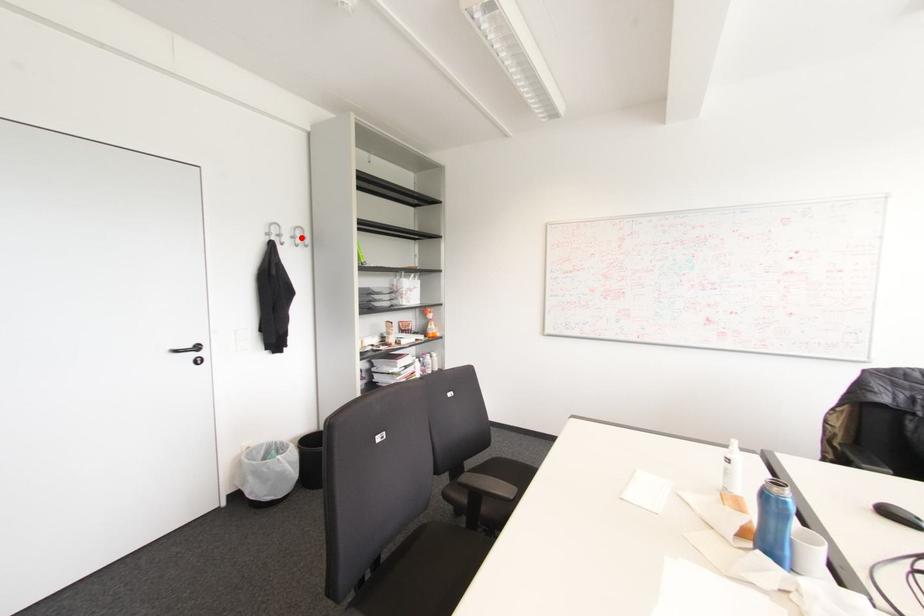
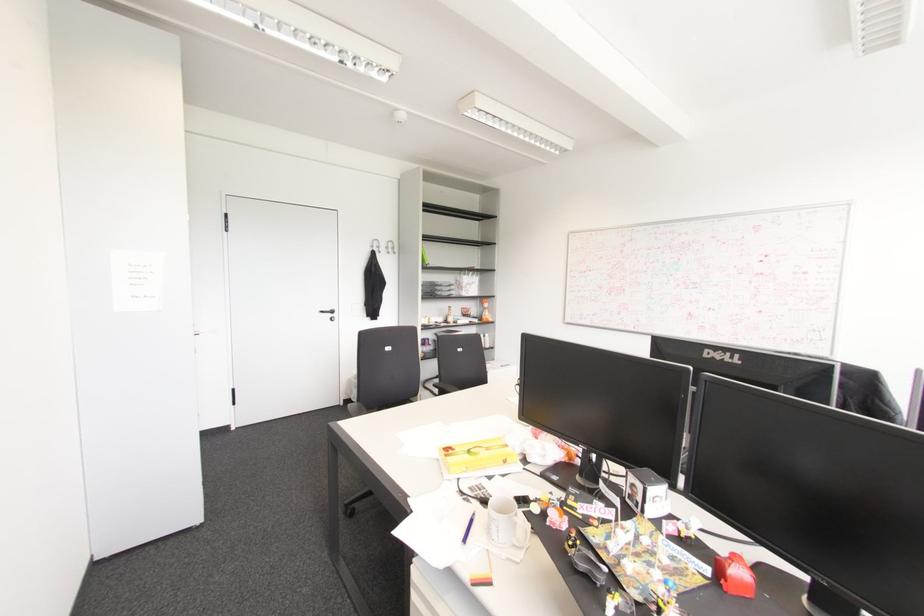
In the second image, find the point that corresponds to the highlighted location in the first image.

(392, 248)